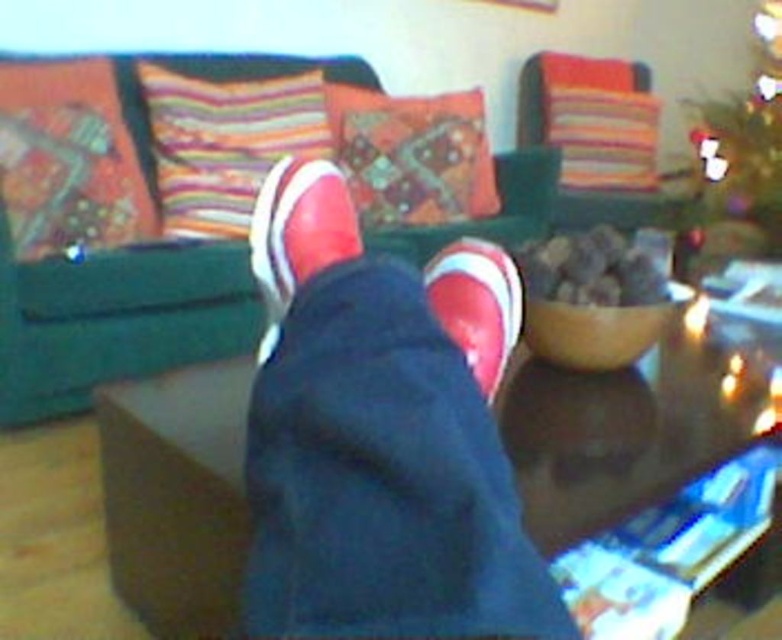
Does green textured christmas tree at upper right appear over matte red sneaker at center?

Yes, green textured christmas tree at upper right is above matte red sneaker at center.

The image size is (782, 640). What do you see at coordinates (744, 145) in the screenshot?
I see `green textured christmas tree at upper right` at bounding box center [744, 145].

Find the location of a particular element. green textured christmas tree at upper right is located at coordinates (744, 145).

Describe the element at coordinates (382, 435) in the screenshot. I see `rubberized red sneakers at center` at that location.

Does rubberized red sneakers at center have a larger size compared to green fabric couch at upper center?

No, rubberized red sneakers at center is not bigger than green fabric couch at upper center.

Which is behind, point (391, 634) or point (170, 282)?

Positioned behind is point (170, 282).

Locate an element on the screen. The image size is (782, 640). rubberized red sneakers at center is located at coordinates (382, 435).

Does point (465, 387) come in front of point (350, 230)?

Yes, point (465, 387) is in front of point (350, 230).

Between point (318, 202) and point (350, 202), which one is positioned behind?

The point (350, 202) is behind.

This screenshot has height=640, width=782. In order to click on rubberized red sneakers at center in this screenshot , I will do `click(382, 435)`.